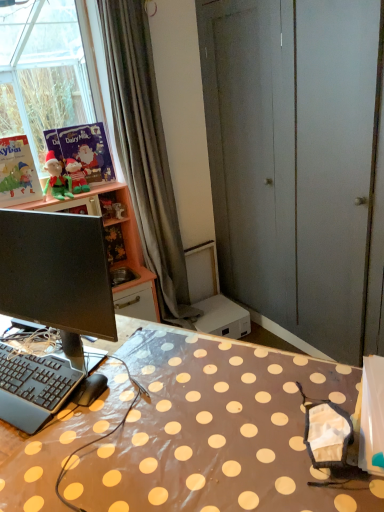
Describe the element at coordinates (57, 274) in the screenshot. I see `black matte computer monitor at left` at that location.

The width and height of the screenshot is (384, 512). What do you see at coordinates (215, 431) in the screenshot?
I see `brown polka dot table at center` at bounding box center [215, 431].

What is the approximate width of matte paper book at upper left, which ranks as the 1th book in right-to-left order?

matte paper book at upper left, which ranks as the 1th book in right-to-left order, is 2.47 inches in width.

You are a GUI agent. You are given a task and a screenshot of the screen. Output one action in this format:
    pyautogui.click(x=<x>, y=<y>)
    Task: Click on the matte pink cabinet at upper left
    This screenshot has height=512, width=384.
    Given the screenshot: What is the action you would take?
    pyautogui.click(x=123, y=243)

Consider the image. Is black rubberized computer mouse at lower left at the back of brown polka dot table at center?

No, black rubberized computer mouse at lower left is not at the back of brown polka dot table at center.

Which is in front, brown polka dot table at center or black rubberized computer mouse at lower left?

brown polka dot table at center is more forward.

Can black rubberized computer mouse at lower left be found inside brown polka dot table at center?

No, black rubberized computer mouse at lower left is not surrounded by brown polka dot table at center.

Looking at this image, measure the distance between brown polka dot table at center and black rubberized computer mouse at lower left.

brown polka dot table at center is 11.57 inches from black rubberized computer mouse at lower left.

The height and width of the screenshot is (512, 384). What are the coordinates of `desk lying on the right of matte paper book at upper left, the second book viewed from the left` in the screenshot? It's located at (215, 431).

Which is behind, point (87, 494) or point (45, 139)?

Point (45, 139)

Is brown polka dot table at center placed right next to matte paper book at upper left, the second book viewed from the left?

No, brown polka dot table at center is not making contact with matte paper book at upper left, the second book viewed from the left.

Considering the relative sizes of brown polka dot table at center and matte paper book at upper left, which ranks as the 1th book in right-to-left order, in the image provided, is brown polka dot table at center taller than matte paper book at upper left, which ranks as the 1th book in right-to-left order,?

Indeed, brown polka dot table at center has a greater height compared to matte paper book at upper left, which ranks as the 1th book in right-to-left order.

Is matte gray screen door at center located outside black plastic keyboard at lower left?

Indeed, matte gray screen door at center is completely outside black plastic keyboard at lower left.

Does matte gray screen door at center appear on the right side of black plastic keyboard at lower left?

Indeed, matte gray screen door at center is positioned on the right side of black plastic keyboard at lower left.

From a real-world perspective, between matte gray screen door at center and black plastic keyboard at lower left, who is vertically lower?

black plastic keyboard at lower left.

Which is in front, matte gray screen door at center or black plastic keyboard at lower left?

black plastic keyboard at lower left is closer to the camera.

How many degrees apart are the facing directions of black rubberized computer mouse at lower left and matte green plush at upper left, which is the 2th person in left-to-right order?

There is a 59.2-degree angle between the facing directions of black rubberized computer mouse at lower left and matte green plush at upper left, which is the 2th person in left-to-right order.

Is black rubberized computer mouse at lower left situated inside matte green plush at upper left, which appears as the 1th person when viewed from the right, or outside?

black rubberized computer mouse at lower left exists outside the volume of matte green plush at upper left, which appears as the 1th person when viewed from the right.

Is black rubberized computer mouse at lower left oriented away from matte green plush at upper left, which appears as the 1th person when viewed from the right?

No, matte green plush at upper left, which appears as the 1th person when viewed from the right, is not at the back of black rubberized computer mouse at lower left.

From the picture: From a real-world perspective, is black rubberized computer mouse at lower left over matte green plush at upper left, which appears as the 1th person when viewed from the right?

No, from a real-world perspective, black rubberized computer mouse at lower left is not over matte green plush at upper left, which appears as the 1th person when viewed from the right

Looking at this image, which is behind, matte green plush at upper left, which is the 2th person in left-to-right order, or black plastic keyboard at lower left?

matte green plush at upper left, which is the 2th person in left-to-right order, is further from the camera.

From the image's perspective, which object appears higher, matte green plush at upper left, which appears as the 1th person when viewed from the right, or black plastic keyboard at lower left?

matte green plush at upper left, which appears as the 1th person when viewed from the right, is shown above in the image.

Between matte green plush at upper left, which appears as the 1th person when viewed from the right, and black plastic keyboard at lower left, which one has larger size?

Bigger between the two is black plastic keyboard at lower left.

Consider the image. Does matte green plush at upper left, which appears as the 1th person when viewed from the right, have a lesser height compared to black plastic keyboard at lower left?

No, matte green plush at upper left, which appears as the 1th person when viewed from the right, is not shorter than black plastic keyboard at lower left.

Can you confirm if brown polka dot table at center is wider than gray fabric curtain at upper left?

Correct, the width of brown polka dot table at center exceeds that of gray fabric curtain at upper left.

Does point (287, 469) come in front of point (129, 156)?

Yes, point (287, 469) is closer to viewer.

Is the surface of brown polka dot table at center in direct contact with gray fabric curtain at upper left?

No, brown polka dot table at center is not beside gray fabric curtain at upper left.

Are matte pink cabinet at upper left and black plastic keyboard at lower left beside each other?

Answer: No, matte pink cabinet at upper left is not with black plastic keyboard at lower left.

Is matte pink cabinet at upper left closer to the viewer compared to black plastic keyboard at lower left?

No.

Based on the photo, from the image's perspective, between matte pink cabinet at upper left and black plastic keyboard at lower left, who is located below?

black plastic keyboard at lower left, from the image's perspective.

How many degrees apart are the facing directions of matte pink cabinet at upper left and black plastic keyboard at lower left?

62.5 degrees.

What are the coordinates of `computer mouse located on the left of brown polka dot table at center` in the screenshot? It's located at (89, 390).

The height and width of the screenshot is (512, 384). I want to click on desk located underneath the matte paper book at upper left, the second book viewed from the left (from a real-world perspective), so (x=215, y=431).

Looking at this image, which object lies further to the anchor point black matte computer monitor at left, matte paper book at upper left, the second book when ordered from right to left, or matte paper book at upper left, the second book viewed from the left?

matte paper book at upper left, the second book viewed from the left, lies further to black matte computer monitor at left than the other object.

Based on their spatial positions, is brown polka dot table at center or matte paper book at upper left, the second book viewed from the left, closer to gray fabric curtain at upper left?

The object closer to gray fabric curtain at upper left is matte paper book at upper left, the second book viewed from the left.

Considering their positions, is brown polka dot table at center positioned closer to green plush elf at left, the 2th person from the right, than black matte computer monitor at left?

black matte computer monitor at left.

Which object lies further to the anchor point green plush elf at left, the 2th person from the right, black rubberized computer mouse at lower left or black plastic keyboard at lower left?

black rubberized computer mouse at lower left lies further to green plush elf at left, the 2th person from the right, than the other object.

Which object lies nearer to the anchor point black plastic keyboard at lower left, black rubberized computer mouse at lower left or matte pink cabinet at upper left?

The object closer to black plastic keyboard at lower left is black rubberized computer mouse at lower left.

Based on their spatial positions, is green plush elf at left, which appears as the first person when viewed from the left, or black plastic keyboard at lower left further from black matte computer monitor at left?

green plush elf at left, which appears as the first person when viewed from the left, lies further to black matte computer monitor at left than the other object.

Which object lies further to the anchor point brown polka dot table at center, matte pink cabinet at upper left or black rubberized computer mouse at lower left?

matte pink cabinet at upper left.

Estimate the real-world distances between objects in this image. Which object is further from matte paper book at upper left, the second book viewed from the left, matte gray screen door at center or green plush elf at left, the 2th person from the right?

matte gray screen door at center.

This screenshot has width=384, height=512. In order to click on computer mouse that lies between matte gray screen door at center and brown polka dot table at center from top to bottom in this screenshot , I will do `click(89, 390)`.

Identify the location of book between black rubberized computer mouse at lower left and matte paper book at upper left, the second book viewed from the left, from front to back. (17, 172).

Identify the location of book between black matte computer monitor at left and green plush elf at left, the 2th person from the right, in the front-back direction. (17, 172).

What are the coordinates of `computer mouse between black matte computer monitor at left and matte pink cabinet at upper left along the z-axis` in the screenshot? It's located at (89, 390).